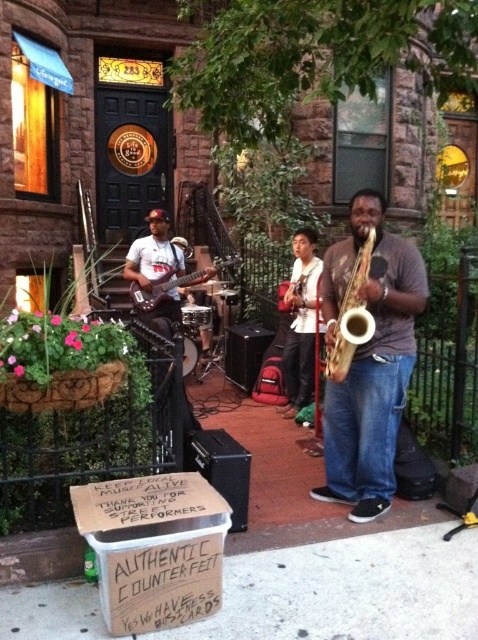
You are a photographer trying to capture the street performance. You want to frame both the shiny gold saxophone at center and the shiny black electric guitar at center in your shot. Which instrument should you focus on first if you want to ensure both are in the frame without cropping?

The shiny gold saxophone at center is smaller than the shiny black electric guitar at center. To ensure both are in the frame without cropping, focus on the larger shiny black electric guitar at center first, then adjust the shot to include the smaller saxophone.